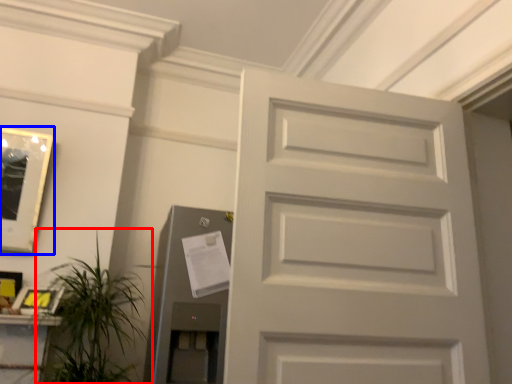
Question: Which object is closer to the camera taking this photo, houseplant (highlighted by a red box) or picture frame (highlighted by a blue box)?

Choices:
 (A) houseplant
 (B) picture frame

Answer: (A)